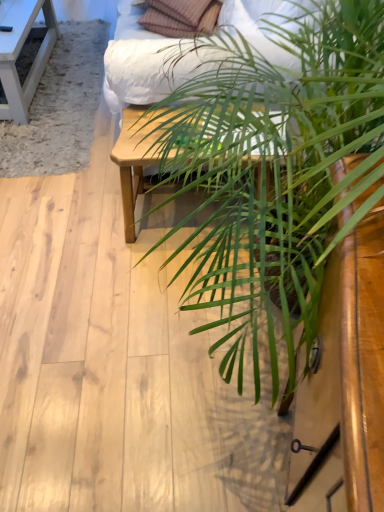
You are a GUI agent. You are given a task and a screenshot of the screen. Output one action in this format:
    pyautogui.click(x=<x>, y=<y>)
    Task: Click on the green leafy plant at center
    
    Given the screenshot: What is the action you would take?
    pyautogui.click(x=276, y=170)

What is the approximate width of white wood table at upper left, the second table in the right-to-left sequence?

white wood table at upper left, the second table in the right-to-left sequence, is 1.19 meters wide.

What do you see at coordinates (148, 66) in the screenshot?
I see `matte white bed frame at upper center` at bounding box center [148, 66].

Find the location of `light wood table at center, which ranks as the first table in front-to-back order`. light wood table at center, which ranks as the first table in front-to-back order is located at coordinates (136, 157).

Between plaid fabric pillow at upper center and light wood table at center, acting as the second table starting from the back, which one is positioned in front?

light wood table at center, acting as the second table starting from the back, is in front.

Would you say plaid fabric pillow at upper center is outside light wood table at center, the first table when ordered from bottom to top?

plaid fabric pillow at upper center lies outside light wood table at center, the first table when ordered from bottom to top,'s area.

Is plaid fabric pillow at upper center at the right side of light wood table at center, the first table when ordered from right to left?

Correct, you'll find plaid fabric pillow at upper center to the right of light wood table at center, the first table when ordered from right to left.

Does plaid fabric pillow at upper center have a lesser height compared to light wood table at center, acting as the second table starting from the left?

Yes.

Is white wood table at upper left, the 1th table in the top-to-bottom sequence, turned away from plaid fabric pillow at upper center?

No, white wood table at upper left, the 1th table in the top-to-bottom sequence, is not facing the opposite direction of plaid fabric pillow at upper center.

Starting from the plaid fabric pillow at upper center, which table is the 2nd one to the left? Please provide its 2D coordinates.

[(19, 52)]

Does point (19, 27) come in front of point (168, 14)?

No, (19, 27) is behind (168, 14).

From a real-world perspective, relative to plaid fabric pillow at upper center, is white wood table at upper left, which appears as the first table when viewed from the left, vertically above or below?

In terms of real-world spatial position, white wood table at upper left, which appears as the first table when viewed from the left, is below plaid fabric pillow at upper center.

Consider the image. Between light wood table at center, acting as the second table starting from the left, and matte white bed frame at upper center, which one appears on the right side from the viewer's perspective?

Positioned to the right is matte white bed frame at upper center.

In the scene shown: From a real-world perspective, which is physically below, light wood table at center, the first table when ordered from bottom to top, or matte white bed frame at upper center?

From a 3D spatial view, light wood table at center, the first table when ordered from bottom to top, is below.

In the scene shown: Between light wood table at center, the first table when ordered from right to left, and matte white bed frame at upper center, which one has more height?

matte white bed frame at upper center.

Consider the image. Can you confirm if light wood table at center, which ranks as the first table in front-to-back order, is smaller than matte white bed frame at upper center?

Indeed, light wood table at center, which ranks as the first table in front-to-back order, has a smaller size compared to matte white bed frame at upper center.

Which is correct: light wood table at center, the first table when ordered from right to left, is inside plaid fabric pillow at upper center, or outside of it?

light wood table at center, the first table when ordered from right to left, is not enclosed by plaid fabric pillow at upper center.

From the image's perspective, which one is positioned lower, light wood table at center, the first table when ordered from bottom to top, or plaid fabric pillow at upper center?

light wood table at center, the first table when ordered from bottom to top, is shown below in the image.

Based on the photo, considering the relative positions of light wood table at center, which ranks as the first table in front-to-back order, and plaid fabric pillow at upper center in the image provided, is light wood table at center, which ranks as the first table in front-to-back order, to the right of plaid fabric pillow at upper center from the viewer's perspective?

No, light wood table at center, which ranks as the first table in front-to-back order, is not to the right of plaid fabric pillow at upper center.

Can you tell me how much light wood table at center, the first table when ordered from bottom to top, and plaid fabric pillow at upper center differ in facing direction?

They differ by 22.6 degrees in their facing directions.

How far apart are white wood table at upper left, the 2th table positioned from the front, and green leafy plant at center?

A distance of 1.73 meters exists between white wood table at upper left, the 2th table positioned from the front, and green leafy plant at center.

From the image's perspective, is white wood table at upper left, which appears as the first table when viewed from the left, on top of green leafy plant at center?

Indeed, from the image's perspective, white wood table at upper left, which appears as the first table when viewed from the left, is shown above green leafy plant at center.

Is green leafy plant at center at the back of white wood table at upper left, which appears as the second table when ordered from the bottom?

white wood table at upper left, which appears as the second table when ordered from the bottom, is not turned away from green leafy plant at center.

Is white wood table at upper left, the second table in the right-to-left sequence, not close to green leafy plant at center?

Yes, white wood table at upper left, the second table in the right-to-left sequence, is far from green leafy plant at center.

I want to click on the 1st table to the left of the green leafy plant at center, counting from the anchor's position, so click(136, 157).

Is green leafy plant at center outside of light wood table at center, marked as the second table in a top-to-bottom arrangement?

Yes, green leafy plant at center is not within light wood table at center, marked as the second table in a top-to-bottom arrangement.

Considering the sizes of objects green leafy plant at center and light wood table at center, marked as the second table in a top-to-bottom arrangement, in the image provided, who is shorter, green leafy plant at center or light wood table at center, marked as the second table in a top-to-bottom arrangement,?

light wood table at center, marked as the second table in a top-to-bottom arrangement.

Does green leafy plant at center have a larger size compared to light wood table at center, which ranks as the first table in front-to-back order?

Indeed, green leafy plant at center has a larger size compared to light wood table at center, which ranks as the first table in front-to-back order.

From the picture: Considering the relative positions of plaid fabric pillow at upper center and matte white bed frame at upper center in the image provided, is plaid fabric pillow at upper center to the left of matte white bed frame at upper center from the viewer's perspective?

Indeed, plaid fabric pillow at upper center is positioned on the left side of matte white bed frame at upper center.

Do you think plaid fabric pillow at upper center is within matte white bed frame at upper center, or outside of it?

plaid fabric pillow at upper center fits inside matte white bed frame at upper center.

Is plaid fabric pillow at upper center facing away from matte white bed frame at upper center?

Absolutely, plaid fabric pillow at upper center is directed away from matte white bed frame at upper center.

Considering the sizes of objects plaid fabric pillow at upper center and matte white bed frame at upper center in the image provided, who is smaller, plaid fabric pillow at upper center or matte white bed frame at upper center?

Smaller between the two is plaid fabric pillow at upper center.

Locate an element on the screen. Image resolution: width=384 pixels, height=512 pixels. the 2nd table below the plaid fabric pillow at upper center (from a real-world perspective) is located at coordinates (136, 157).

Locate an element on the screen. pillow in front of the white wood table at upper left, which appears as the second table when ordered from the bottom is located at coordinates (181, 17).

Estimate the real-world distances between objects in this image. Which object is closer to matte white bed frame at upper center, green leafy plant at center or white wood table at upper left, which appears as the second table when ordered from the bottom?

green leafy plant at center is closer to matte white bed frame at upper center.

Looking at the image, which one is located closer to green leafy plant at center, matte white bed frame at upper center or light wood table at center, acting as the second table starting from the left?

light wood table at center, acting as the second table starting from the left, lies closer to green leafy plant at center than the other object.

Estimate the real-world distances between objects in this image. Which object is further from white wood table at upper left, the second table in the right-to-left sequence, light wood table at center, the first table when ordered from bottom to top, or matte white bed frame at upper center?

light wood table at center, the first table when ordered from bottom to top, is positioned further to the anchor white wood table at upper left, the second table in the right-to-left sequence.

From the image, which object appears to be nearer to green leafy plant at center, plaid fabric pillow at upper center or matte white bed frame at upper center?

Based on the image, matte white bed frame at upper center appears to be nearer to green leafy plant at center.

Considering their positions, is green leafy plant at center positioned closer to matte white bed frame at upper center than plaid fabric pillow at upper center?

green leafy plant at center is positioned closer to the anchor matte white bed frame at upper center.

Estimate the real-world distances between objects in this image. Which object is closer to light wood table at center, marked as the second table in a top-to-bottom arrangement, matte white bed frame at upper center or green leafy plant at center?

green leafy plant at center.

Estimate the real-world distances between objects in this image. Which object is further from plaid fabric pillow at upper center, white wood table at upper left, the 2th table positioned from the front, or green leafy plant at center?

green leafy plant at center is positioned further to the anchor plaid fabric pillow at upper center.

When comparing their distances from light wood table at center, which ranks as the first table in front-to-back order, does green leafy plant at center or plaid fabric pillow at upper center seem closer?

The object closer to light wood table at center, which ranks as the first table in front-to-back order, is green leafy plant at center.

Locate an element on the screen. Image resolution: width=384 pixels, height=512 pixels. pillow between white wood table at upper left, the 1th table in the top-to-bottom sequence, and matte white bed frame at upper center is located at coordinates (181, 17).

Find the location of a particular element. This screenshot has width=384, height=512. pillow between matte white bed frame at upper center and light wood table at center, marked as the second table in a top-to-bottom arrangement, from top to bottom is located at coordinates (181, 17).

You are a GUI agent. You are given a task and a screenshot of the screen. Output one action in this format:
    pyautogui.click(x=<x>, y=<y>)
    Task: Click on the table between white wood table at upper left, the 2th table positioned from the front, and plaid fabric pillow at upper center from left to right
    Image resolution: width=384 pixels, height=512 pixels.
    Given the screenshot: What is the action you would take?
    pyautogui.click(x=136, y=157)

Locate an element on the screen. The width and height of the screenshot is (384, 512). table between green leafy plant at center and plaid fabric pillow at upper center along the z-axis is located at coordinates (136, 157).